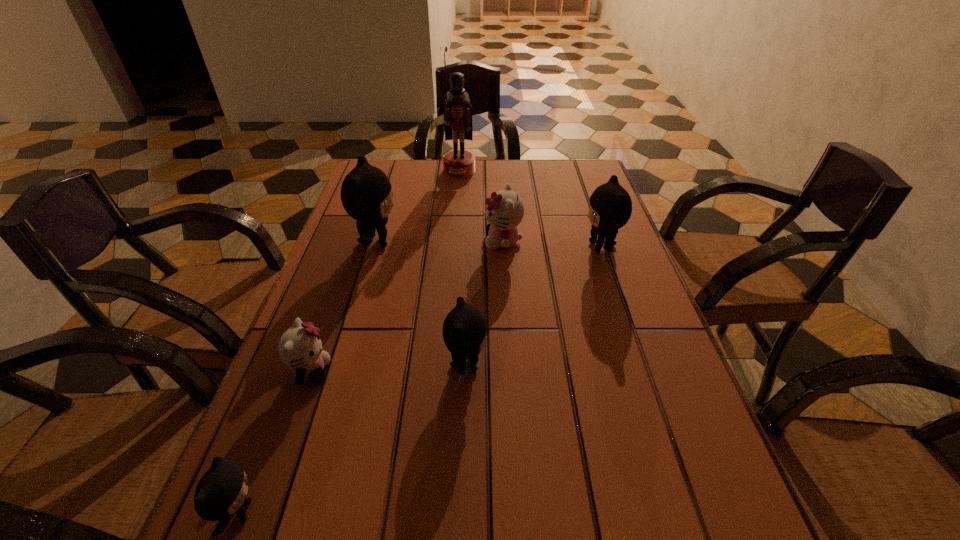
Find the location of a particular element. Image resolution: width=960 pixels, height=540 pixels. free region located 0.250m on the front-facing side of the second nearest gray kitten is located at coordinates (613, 364).

This screenshot has width=960, height=540. Find the location of `vacant space located 0.240m on the front-facing side of the smaller white kitten`. vacant space located 0.240m on the front-facing side of the smaller white kitten is located at coordinates (454, 372).

What are the coordinates of `object situated at the far edge` in the screenshot? It's located at (457, 111).

This screenshot has height=540, width=960. I want to click on object that is at the right edge, so click(610, 206).

Find the location of a particular element. The image size is (960, 540). free point at the far edge is located at coordinates (496, 181).

Image resolution: width=960 pixels, height=540 pixels. In the image, there is a desktop. Identify the location of vacant space at the left edge. (329, 329).

In order to click on free spot at the right edge of the desktop in this screenshot , I will do `click(597, 238)`.

Find the location of a particular element. This screenshot has height=540, width=960. vacant space that is in between the biggest gray kitten and the left white kitten is located at coordinates (344, 307).

The height and width of the screenshot is (540, 960). What are the coordinates of `empty space that is in between the right white kitten and the smaller white kitten` in the screenshot? It's located at (407, 307).

Locate an element on the screen. The width and height of the screenshot is (960, 540). vacant space in between the smaller white kitten and the biggest gray kitten is located at coordinates (344, 307).